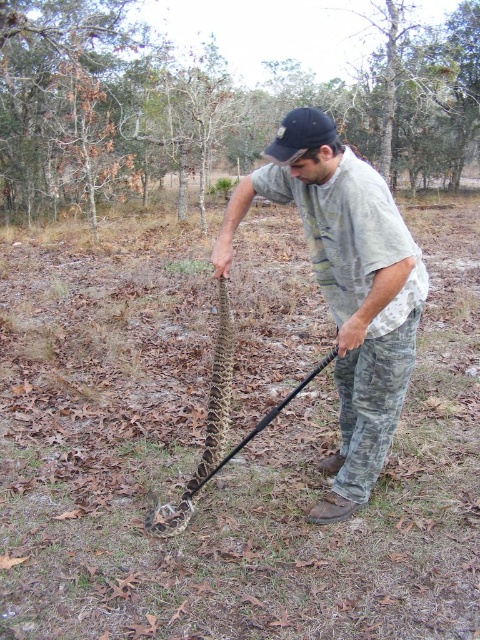
You are a wildlife photographer trying to capture a clear photo of the man and the snake. You notice the camouflage pants at center and the black fabric baseball cap at center in your viewfinder. Which of these two items appears narrower in the image?

The camouflage pants at center appears narrower than the black fabric baseball cap at center in the image.

You are a photographer standing at the same position as the man in the image. You want to take a photo that includes both the brown textured tree at center and the black fabric baseball cap at center. Which object should you adjust your focus to ensure both are in the frame?

Since the brown textured tree at center is further away from you than the black fabric baseball cap at center, you should adjust your focus to include both by ensuring the tree is within the depth of field when focusing on the cap, or vice versa, depending on your camera settings.